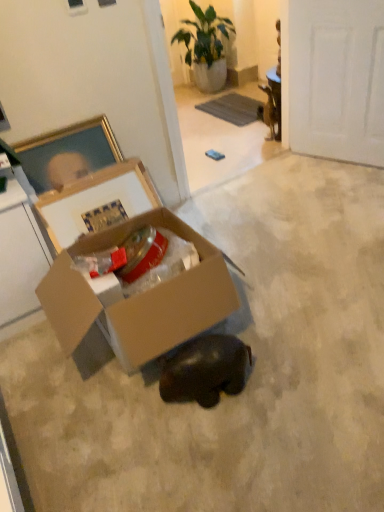
Find the location of `free space in front of shiny black elephant at center`. free space in front of shiny black elephant at center is located at coordinates (223, 451).